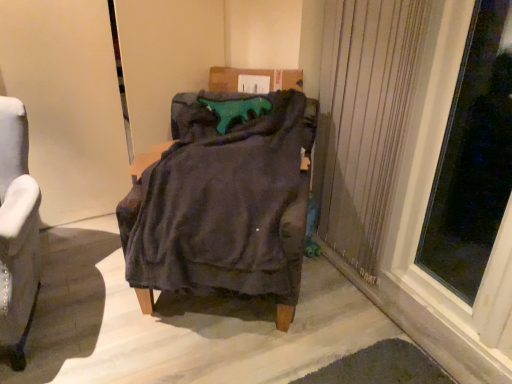
Question: Is transparent glass window at right wider or thinner than velvet dark gray armchair at center?

Choices:
 (A) thin
 (B) wide

Answer: (A)

Question: From the image's perspective, is transparent glass window at right located above or below velvet dark gray armchair at center?

Choices:
 (A) above
 (B) below

Answer: (A)

Question: Estimate the real-world distances between objects in this image. Which object is closer to the velvet gray armchair at left?

Choices:
 (A) transparent glass window at right
 (B) beige textured curtain at right
 (C) velvet dark gray armchair at center

Answer: (C)

Question: Estimate the real-world distances between objects in this image. Which object is closer to the velvet gray armchair at left?

Choices:
 (A) velvet dark gray armchair at center
 (B) transparent glass window at right
 (C) beige textured curtain at right

Answer: (A)